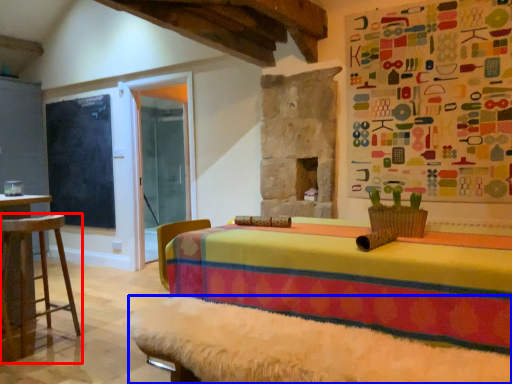
Question: Which object is closer to the camera taking this photo, furniture (highlighted by a red box) or bed frame (highlighted by a blue box)?

Choices:
 (A) furniture
 (B) bed frame

Answer: (B)